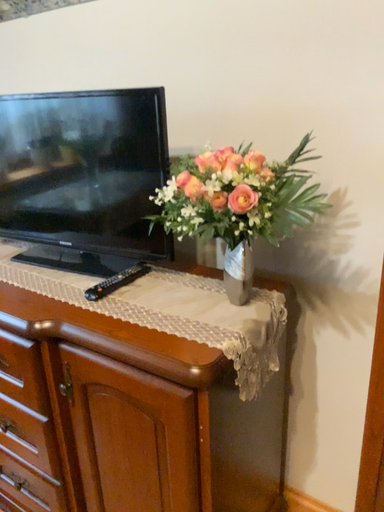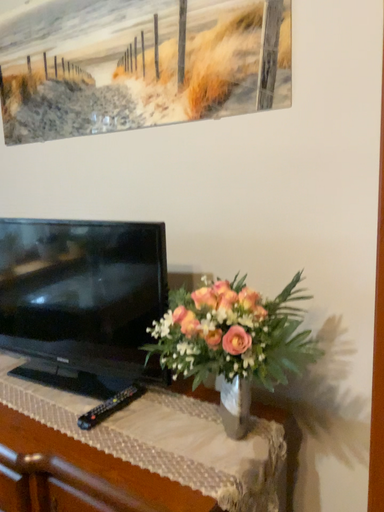
Question: Which way did the camera rotate in the video?

Choices:
 (A) rotated upward
 (B) rotated downward

Answer: (A)